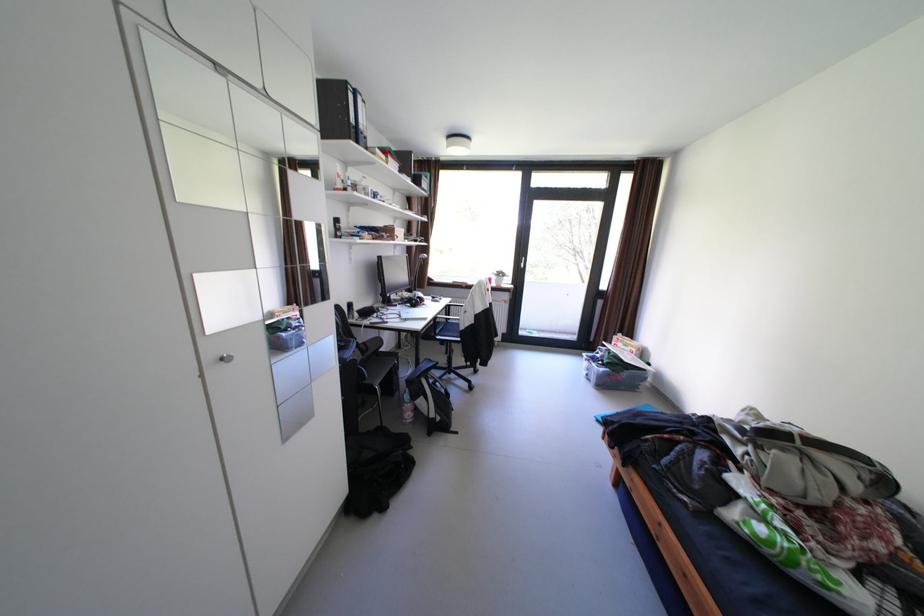
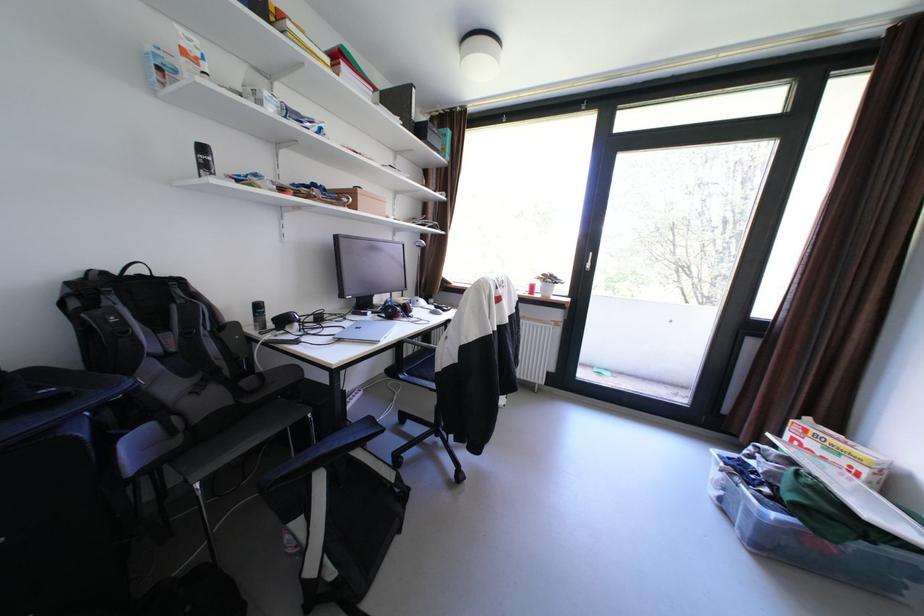
Where in the second image is the point corresponding to the point at 612,370 from the first image?

(784, 516)